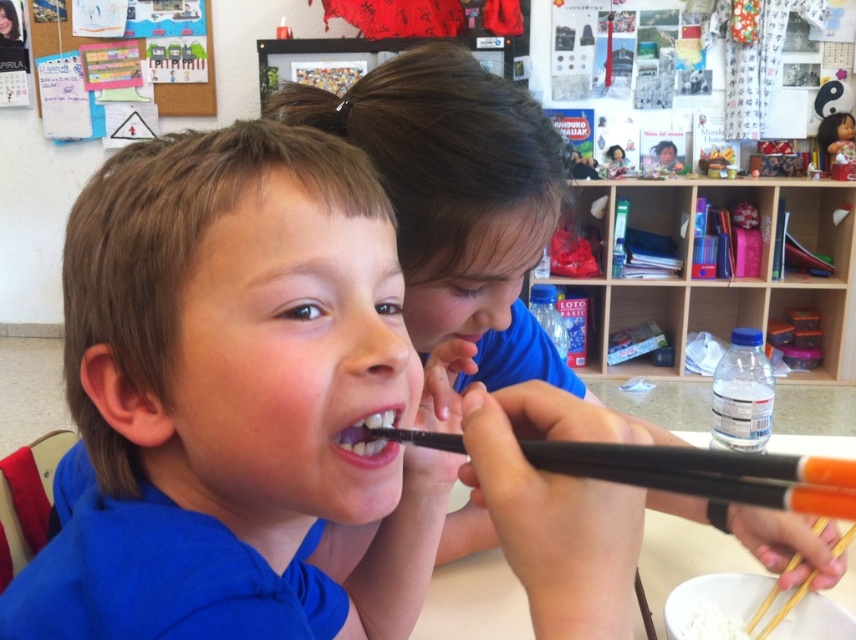
You are a student in the classroom and want to place a sticker exactly where the black plastic chopstick at mouth is located. Where should you place the sticker?

The sticker should be placed at the 2D coordinates point (709, 474) where the black plastic chopstick at mouth is located.